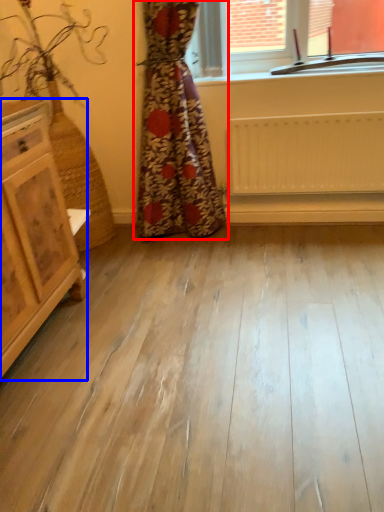
Question: Which object is further to the camera taking this photo, curtain (highlighted by a red box) or chest of drawers (highlighted by a blue box)?

Choices:
 (A) curtain
 (B) chest of drawers

Answer: (A)